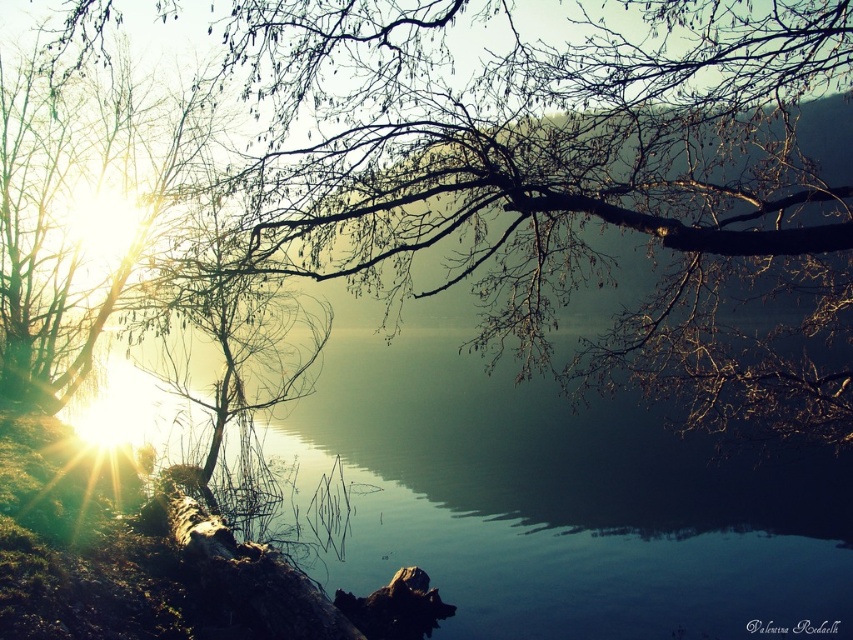
You are an observer standing at the lakeside. You see the brown textured branches at upper center and the transparent water at center. Which object is located above the other?

The brown textured branches at upper center is positioned over transparent water at center, meaning it is above the water.

You are standing at the lakeside and want to take a photo of both point (x=326, y=54) and point (x=126, y=413) in the scene. Which point should you focus on first to ensure both are in sharp focus?

You should focus on point (x=326, y=54) first because it is closer to the camera than point (x=126, y=413), ensuring both will be in focus when using depth of field appropriately.

You are a bird flying over the serene lakeside scene. You spot a specific point at coordinates point (566,180). What object is located at this point?

The point (566,180) corresponds to brown textured branches at upper center.